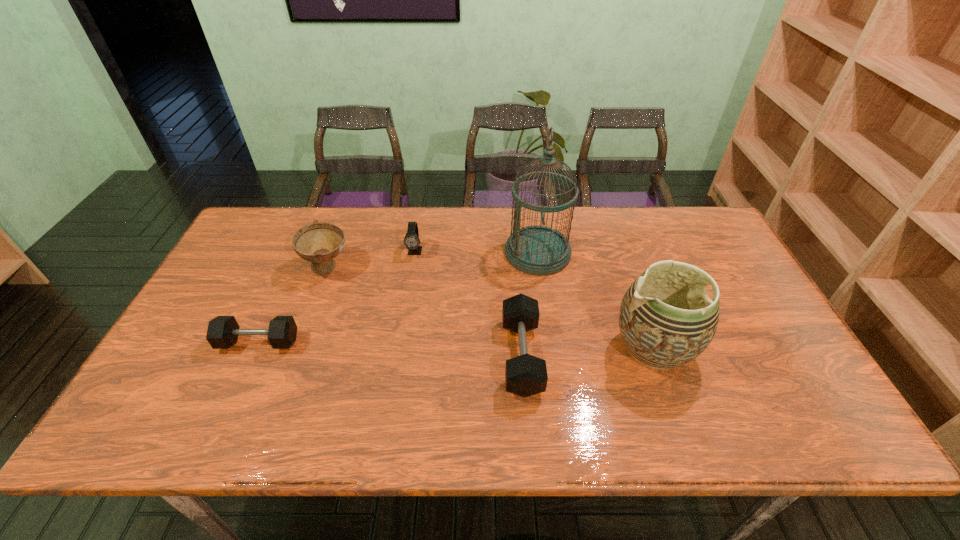
Find the location of a particular element. This screenshot has height=540, width=960. the shortest object is located at coordinates (222, 333).

Where is `the shorter dumbbell`? The width and height of the screenshot is (960, 540). the shorter dumbbell is located at coordinates (222, 333).

Locate an element on the screen. The image size is (960, 540). the taller dumbbell is located at coordinates (525, 375).

Where is `the tallest object`? Image resolution: width=960 pixels, height=540 pixels. the tallest object is located at coordinates (537, 250).

This screenshot has width=960, height=540. Identify the location of soup bowl. coord(319,243).

In order to click on watch in this screenshot , I will do `click(412, 242)`.

Identify the location of the rightmost object. (666, 320).

You are a GUI agent. You are given a task and a screenshot of the screen. Output one action in this format:
    pyautogui.click(x=<x>, y=<y>)
    Task: Click on the second tallest object
    The image size is (960, 540).
    Given the screenshot: What is the action you would take?
    pyautogui.click(x=666, y=320)

The image size is (960, 540). Find the location of `vacant area situated 0.170m on the right of the shorter dumbbell`. vacant area situated 0.170m on the right of the shorter dumbbell is located at coordinates (364, 342).

You are a GUI agent. You are given a task and a screenshot of the screen. Output one action in this format:
    pyautogui.click(x=<x>, y=<y>)
    Task: Click on the vacant space located 0.370m on the left of the taller dumbbell
    The image size is (960, 540).
    Given the screenshot: What is the action you would take?
    pyautogui.click(x=355, y=356)